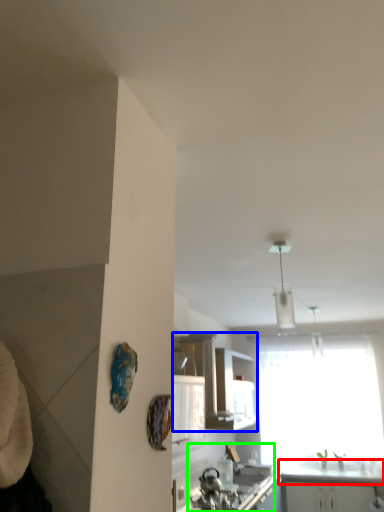
Question: Which object is positioned closest to counter top (highlighted by a red box)? Select from cabinetry (highlighted by a blue box) and sink (highlighted by a green box).

Choices:
 (A) cabinetry
 (B) sink

Answer: (B)